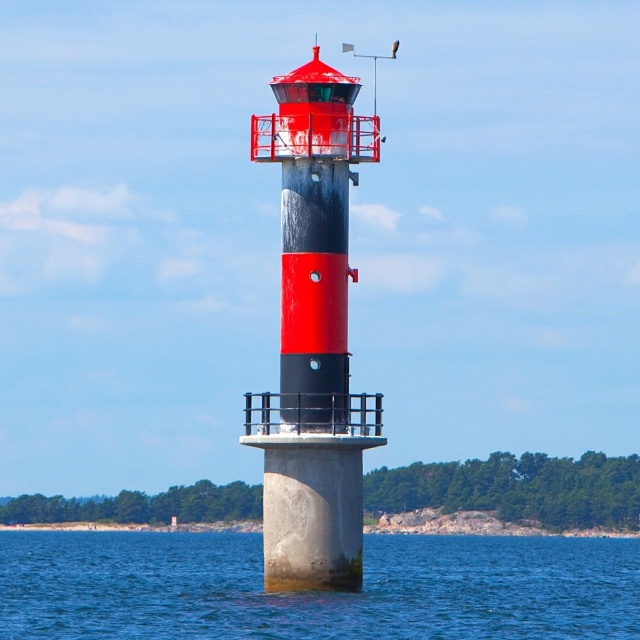
Between blue concrete water at center and smooth concrete lighthouse at center, which one is positioned higher?

smooth concrete lighthouse at center

Is blue concrete water at center positioned in front of smooth concrete lighthouse at center?

That is True.

Who is more distant from viewer, (592, 625) or (380, 428)?

The point (592, 625) is behind.

Image resolution: width=640 pixels, height=640 pixels. I want to click on blue concrete water at center, so click(x=316, y=592).